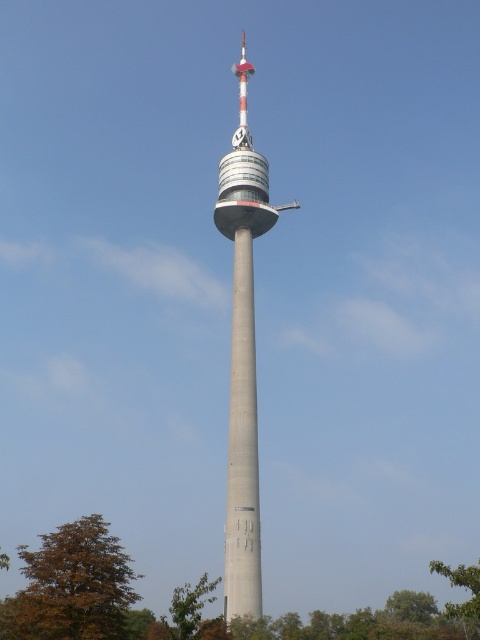
From the picture: Which of these two, brown leafy tree at lower left or green leafy tree at lower left, stands shorter?

Standing shorter between the two is brown leafy tree at lower left.

Does point (51, 582) come in front of point (192, 595)?

Yes, it is.

The image size is (480, 640). What are the coordinates of `brown leafy tree at lower left` in the screenshot? It's located at (72, 586).

Who is positioned more to the right, concrete tower at center or green leafy tree at lower left?

concrete tower at center is more to the right.

Does concrete tower at center lie behind green leafy tree at lower left?

Yes, it is.

Which is behind, point (249, 221) or point (171, 604)?

The point (171, 604) is behind.

The image size is (480, 640). I want to click on concrete tower at center, so 242,355.

Which of these two, concrete tower at center or brown leafy tree at lower left, stands shorter?

Standing shorter between the two is brown leafy tree at lower left.

Is point (232, 328) closer to viewer compared to point (87, 586)?

No, it is not.

Image resolution: width=480 pixels, height=640 pixels. Identify the location of concrete tower at center. (242, 355).